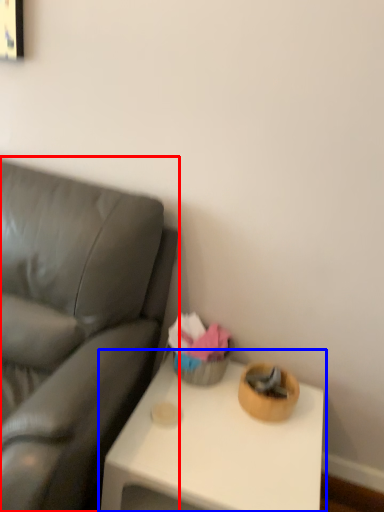
Question: Which object appears farthest to the camera in this image, studio couch (highlighted by a red box) or table (highlighted by a blue box)?

Choices:
 (A) studio couch
 (B) table

Answer: (B)